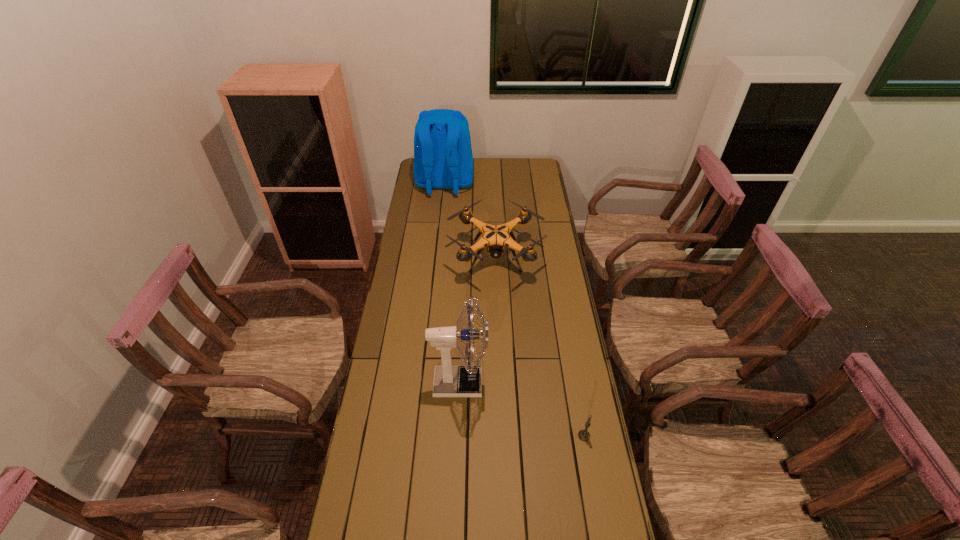
Where is `object that is at the far edge`? Image resolution: width=960 pixels, height=540 pixels. object that is at the far edge is located at coordinates coord(443,159).

You are a GUI agent. You are given a task and a screenshot of the screen. Output one action in this format:
    pyautogui.click(x=<x>, y=<y>)
    Task: Click on the object that is at the left edge
    The image size is (960, 540).
    Given the screenshot: What is the action you would take?
    pyautogui.click(x=443, y=159)

I want to click on drone that is at the right edge, so click(x=495, y=238).

Image resolution: width=960 pixels, height=540 pixels. I want to click on candle located at the right edge, so click(x=583, y=435).

Find the location of a particular element. The height and width of the screenshot is (540, 960). object situated at the far left corner is located at coordinates (443, 159).

I want to click on vacant point at the far edge, so click(484, 167).

Locate an element on the screen. The width and height of the screenshot is (960, 540). vacant space at the left edge of the desktop is located at coordinates (413, 217).

Where is `blank space at the right edge of the desktop`? This screenshot has height=540, width=960. blank space at the right edge of the desktop is located at coordinates (553, 400).

Find the location of a particular element. free space between the second shortest object and the rightmost object is located at coordinates (540, 348).

Where is `free space between the fan and the drone`? free space between the fan and the drone is located at coordinates (477, 321).